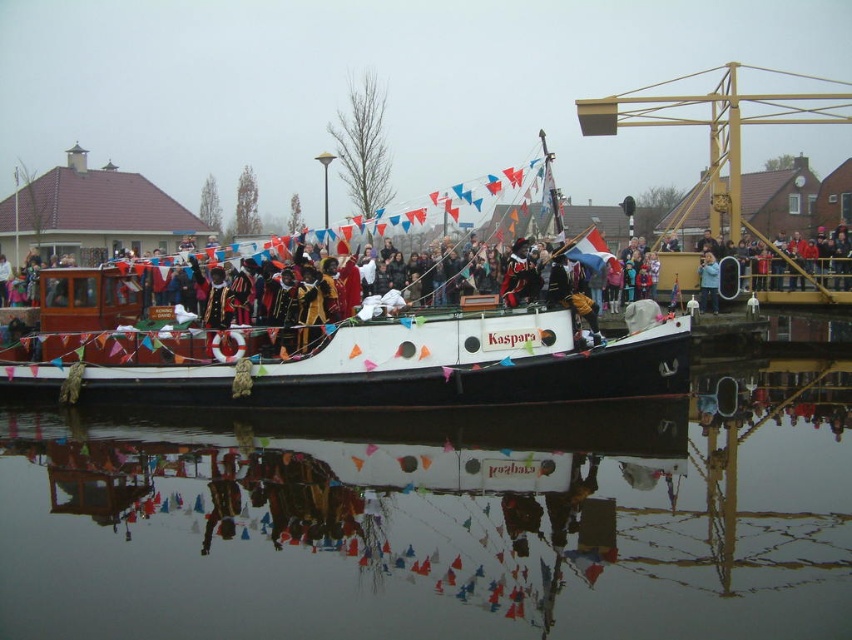
Question: Is transparent water at center below blue fabric jacket at center?

Choices:
 (A) no
 (B) yes

Answer: (B)

Question: From the image, what is the correct spatial relationship of transparent water at center in relation to white matte boat at center?

Choices:
 (A) right
 (B) left

Answer: (A)

Question: Is transparent water at center thinner than white matte boat at center?

Choices:
 (A) yes
 (B) no

Answer: (B)

Question: Which of these objects is positioned closest to the transparent water at center?

Choices:
 (A) blue fabric jacket at center
 (B) white matte boat at center

Answer: (B)

Question: Which point is closer to the camera?

Choices:
 (A) transparent water at center
 (B) white matte boat at center

Answer: (A)

Question: Which point is closer to the camera taking this photo?

Choices:
 (A) (148, 449)
 (B) (699, 307)
 (C) (194, 369)

Answer: (A)